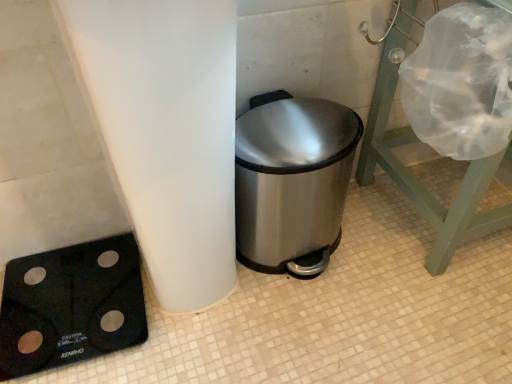
Question: From the image's perspective, is stainless steel trash can at center above black rubberized scale at lower left?

Choices:
 (A) yes
 (B) no

Answer: (A)

Question: Is stainless steel trash can at center oriented towards black rubberized scale at lower left?

Choices:
 (A) no
 (B) yes

Answer: (A)

Question: Is stainless steel trash can at center next to black rubberized scale at lower left and touching it?

Choices:
 (A) yes
 (B) no

Answer: (B)

Question: Can you confirm if stainless steel trash can at center is wider than black rubberized scale at lower left?

Choices:
 (A) yes
 (B) no

Answer: (B)

Question: Is stainless steel trash can at center positioned with its back to black rubberized scale at lower left?

Choices:
 (A) yes
 (B) no

Answer: (B)

Question: Considering the relative sizes of stainless steel trash can at center and black rubberized scale at lower left in the image provided, is stainless steel trash can at center bigger than black rubberized scale at lower left?

Choices:
 (A) yes
 (B) no

Answer: (A)

Question: Can you confirm if transparent plastic shower cap at upper right is wider than stainless steel trash can at center?

Choices:
 (A) no
 (B) yes

Answer: (B)

Question: From the image's perspective, does transparent plastic shower cap at upper right appear lower than stainless steel trash can at center?

Choices:
 (A) no
 (B) yes

Answer: (A)

Question: Can you confirm if transparent plastic shower cap at upper right is smaller than stainless steel trash can at center?

Choices:
 (A) yes
 (B) no

Answer: (B)

Question: Does transparent plastic shower cap at upper right contain stainless steel trash can at center?

Choices:
 (A) no
 (B) yes

Answer: (A)

Question: From the image's perspective, is transparent plastic shower cap at upper right on top of stainless steel trash can at center?

Choices:
 (A) no
 (B) yes

Answer: (B)

Question: Can you confirm if transparent plastic shower cap at upper right is positioned to the left of stainless steel trash can at center?

Choices:
 (A) yes
 (B) no

Answer: (B)

Question: Is stainless steel trash can at center a part of black rubberized scale at lower left?

Choices:
 (A) no
 (B) yes

Answer: (A)